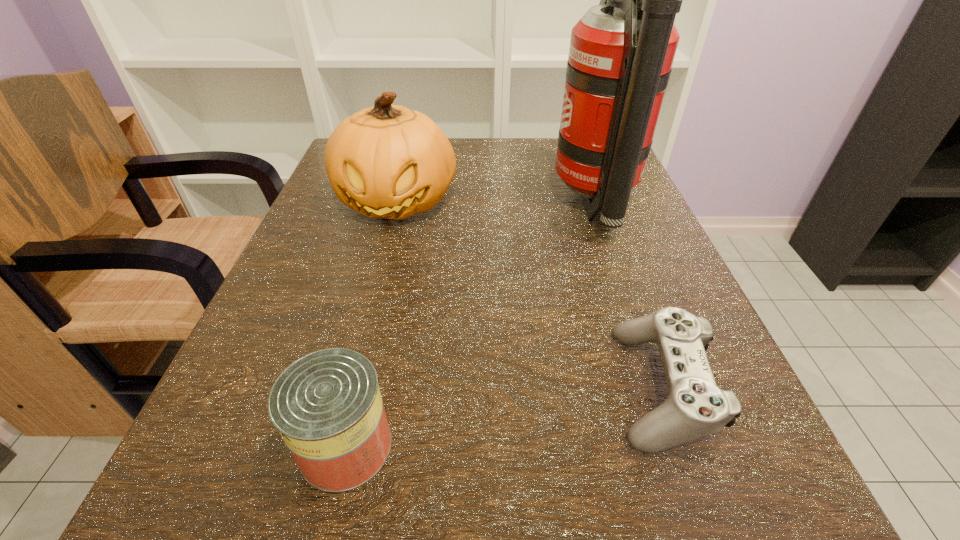
Image resolution: width=960 pixels, height=540 pixels. Identify the location of fire extinguisher that is at the far edge. (621, 53).

The image size is (960, 540). In order to click on pumpkin present at the far edge in this screenshot , I will do `click(387, 161)`.

Identify the location of object situated at the near edge. (327, 406).

Identify the location of pumpkin that is at the left edge. This screenshot has width=960, height=540. (387, 161).

Where is `can at the left edge`? can at the left edge is located at coordinates (327, 406).

You are a GUI agent. You are given a task and a screenshot of the screen. Output one action in this format:
    pyautogui.click(x=<x>, y=<y>)
    Task: Click on the fire extinguisher that is at the right edge
    
    Given the screenshot: What is the action you would take?
    pyautogui.click(x=621, y=53)

I want to click on control at the right edge, so click(x=695, y=407).

In order to click on object that is at the far left corner in this screenshot , I will do `click(387, 161)`.

Where is `object present at the near left corner`? The image size is (960, 540). object present at the near left corner is located at coordinates (327, 406).

Find the location of a particular element. This screenshot has width=960, height=540. object present at the far right corner is located at coordinates (621, 53).